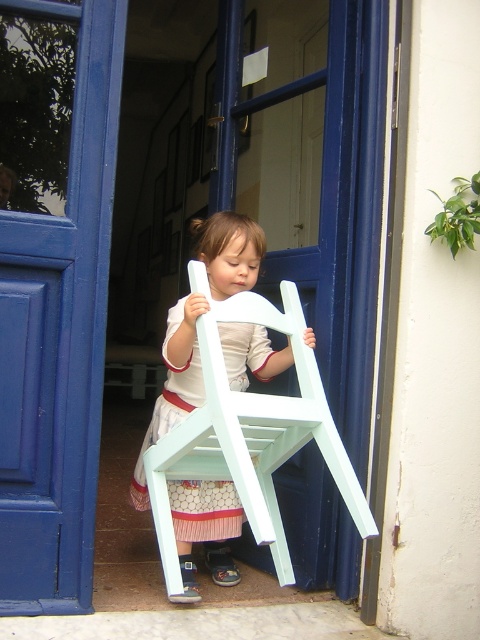
You are a delivery person trying to move a matte white chair at center through the blue wooden door at center. Based on their positions, can the chair fit through the door?

The blue wooden door at center is to the left of matte white chair at center, so the door is positioned next to the chair but not directly in front of it. This means the chair cannot be moved through the door as they are adjacent rather than aligned for passage.

You are helping a child move a chair. The child is holding the matte white chair at center near the blue wooden door at center. If the door is narrower than the chair, will the chair fit through the door?

The blue wooden door at center has a lesser width compared to matte white chair at center, so the chair will not fit through the door since it is wider than the door opening.